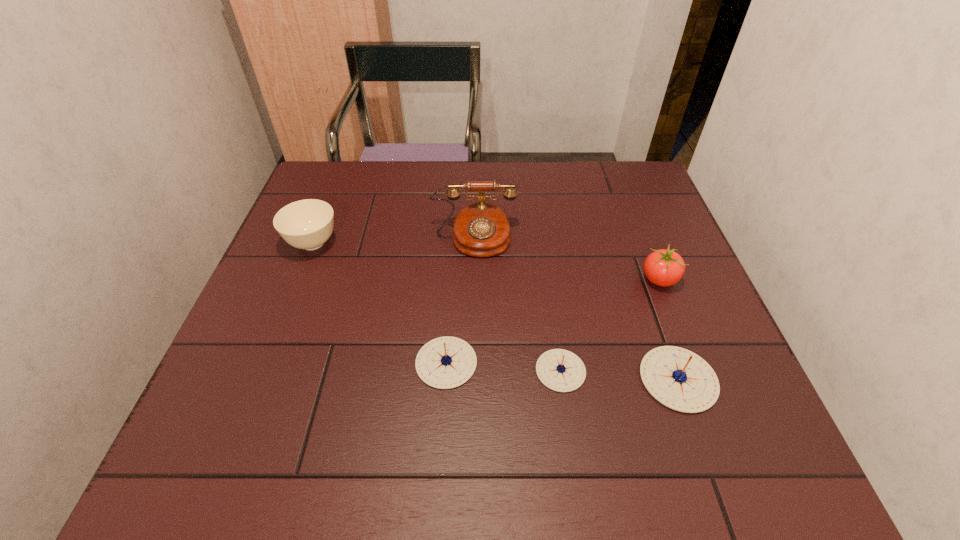
Locate an element on the screen. vacant spot to place a compass on the left is located at coordinates (335, 355).